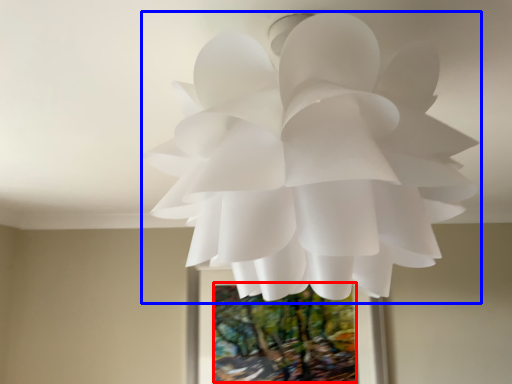
Question: Which point is closer to the camera, tree (highlighted by a red box) or flower (highlighted by a blue box)?

Choices:
 (A) tree
 (B) flower

Answer: (B)